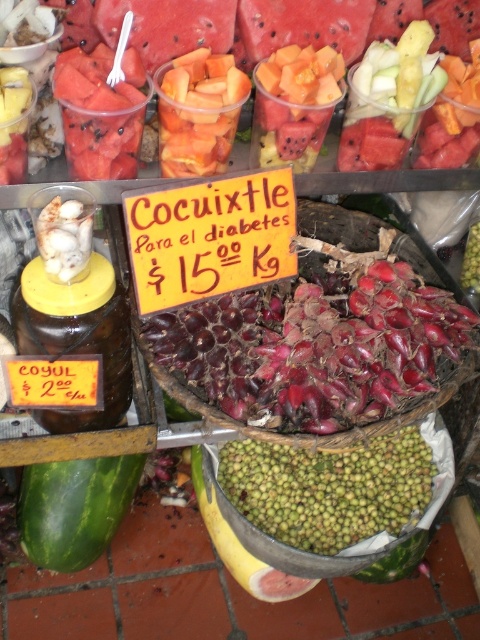
You are a customer at the fruit stand and want to know which item is taller between the shiny red onion at center and the orange fleshed at center. Can you tell me which one?

The shiny red onion at center has a greater height compared to orange fleshed at center, so the shiny red onion at center is taller.

You are standing in front of the fruit stand and want to pick up an item. Which point, point (186, 330) or point (203, 122), is closer to you?

Point (186, 330) is further to the camera than point (203, 122), so the closer point to you is point (203, 122).